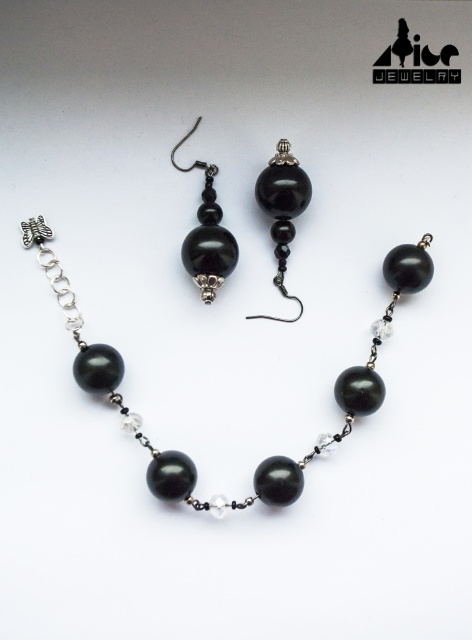
Question: Which point is farther to the camera?

Choices:
 (A) (368, 384)
 (B) (279, 182)
 (C) (192, 260)

Answer: (C)

Question: Is black glossy bead at center further to the viewer compared to black glass bead at center?

Choices:
 (A) yes
 (B) no

Answer: (A)

Question: Is black pearl necklace at center bigger than black glass bead at center?

Choices:
 (A) yes
 (B) no

Answer: (A)

Question: Which of the following is the farthest from the observer?

Choices:
 (A) (288, 472)
 (B) (210, 193)

Answer: (B)

Question: Can you confirm if black pearl necklace at center is wider than black glossy bead at center?

Choices:
 (A) no
 (B) yes

Answer: (B)

Question: Which point is closer to the camera?

Choices:
 (A) black glass bead at center
 (B) black glossy bead at center
 (C) black pearl necklace at center

Answer: (C)